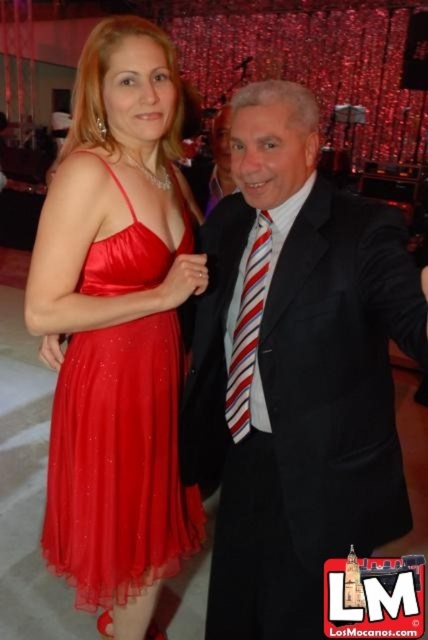
Question: Among these objects, which one is farthest from the camera?

Choices:
 (A) striped fabric tie at center
 (B) satin dress at left
 (C) black satin suit at center

Answer: (B)

Question: Can you confirm if black satin suit at center is positioned above striped fabric tie at center?

Choices:
 (A) no
 (B) yes

Answer: (A)

Question: Can you confirm if black satin suit at center is bigger than satin dress at left?

Choices:
 (A) yes
 (B) no

Answer: (A)

Question: Which of the following is the closest to the observer?

Choices:
 (A) satin dress at left
 (B) black satin suit at center
 (C) striped fabric tie at center

Answer: (B)

Question: In this image, where is satin dress at left located relative to striped fabric tie at center?

Choices:
 (A) below
 (B) above

Answer: (A)

Question: Which of the following is the farthest from the observer?

Choices:
 (A) black satin suit at center
 (B) striped fabric tie at center

Answer: (B)